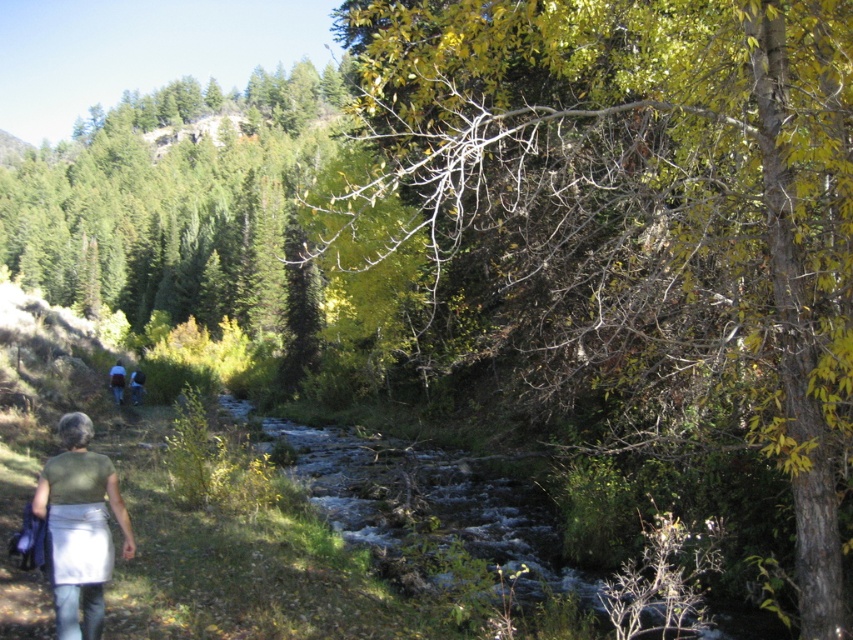
Can you confirm if green leafy tree at upper right is positioned to the right of green fabric backpack at lower left?

Correct, you'll find green leafy tree at upper right to the right of green fabric backpack at lower left.

Is green leafy tree at upper right closer to camera compared to green fabric backpack at lower left?

Yes.

Is point (524, 40) positioned before point (115, 371)?

Yes, it is in front of point (115, 371).

This screenshot has height=640, width=853. I want to click on green leafy tree at upper right, so click(631, 216).

Between point (74, 520) and point (109, 385), which one is positioned behind?

The point (109, 385) is more distant.

Is point (97, 636) behind point (113, 387)?

No, (97, 636) is in front of (113, 387).

Which is in front, point (86, 429) or point (123, 381)?

Point (86, 429)

You are a GUI agent. You are given a task and a screenshot of the screen. Output one action in this format:
    pyautogui.click(x=<x>, y=<y>)
    Task: Click on the light green fabric at lower left
    The image size is (853, 640).
    Given the screenshot: What is the action you would take?
    pyautogui.click(x=80, y=528)

Between green leafy tree at upper right and light green fabric at lower left, which one is positioned higher?

green leafy tree at upper right is higher up.

Who is positioned more to the left, green leafy tree at upper right or light green fabric at lower left?

light green fabric at lower left is more to the left.

Does point (751, 38) come closer to viewer compared to point (105, 461)?

Yes, point (751, 38) is closer to viewer.

The height and width of the screenshot is (640, 853). I want to click on green leafy tree at upper right, so click(631, 216).